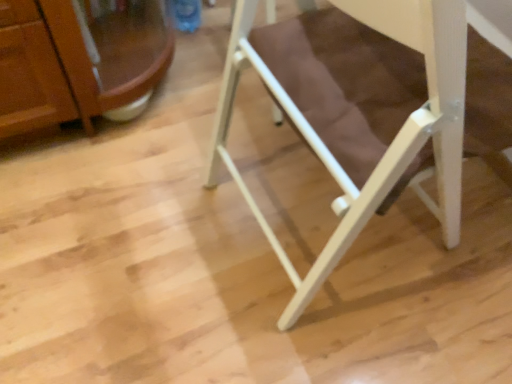
Measure the distance between point (456,122) and camera.

Point (456,122) is 19.76 inches away from camera.

Locate an element on the screen. matte brown cushion at center is located at coordinates (379, 106).

Image resolution: width=512 pixels, height=384 pixels. What do you see at coordinates (379, 106) in the screenshot? I see `matte brown cushion at center` at bounding box center [379, 106].

Where is `matte brown cushion at center`? This screenshot has height=384, width=512. matte brown cushion at center is located at coordinates (379, 106).